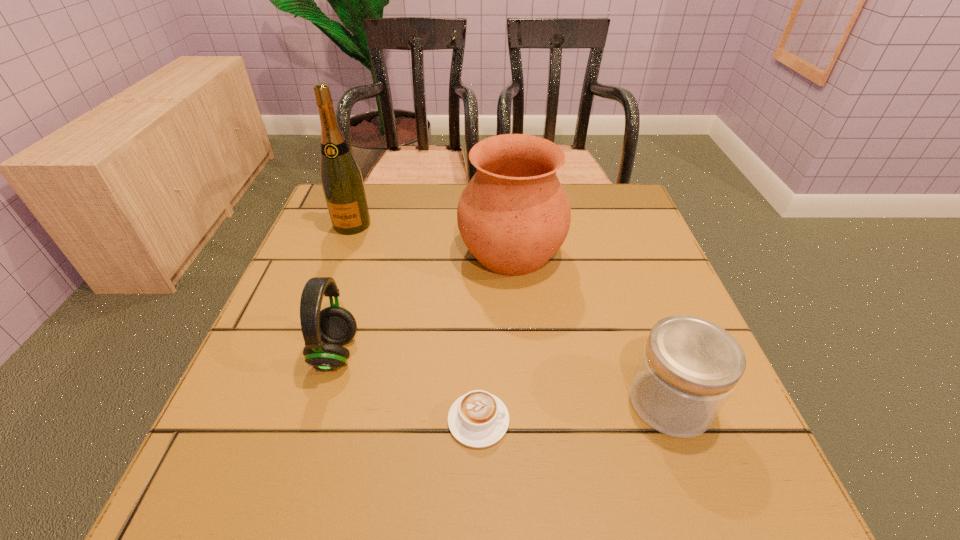
I want to click on free space located with the handle on the right side of the shortest object, so click(x=572, y=420).

Identify the location of wine bottle at the far edge. This screenshot has height=540, width=960. (341, 178).

Where is `pottery that is positioned at the far edge`? pottery that is positioned at the far edge is located at coordinates (514, 215).

The image size is (960, 540). In order to click on object at the near edge in this screenshot , I will do `click(478, 419)`.

I want to click on wine bottle that is at the left edge, so click(x=341, y=178).

Locate an element on the screen. Image resolution: width=960 pixels, height=540 pixels. headset at the left edge is located at coordinates (335, 326).

I want to click on object that is positioned at the right edge, so click(689, 366).

Identify the location of object present at the far left corner. (341, 178).

The image size is (960, 540). What are the coordinates of `free location at the far edge of the desktop` in the screenshot? It's located at (408, 188).

Identify the location of vacant space at the right edge. (595, 241).